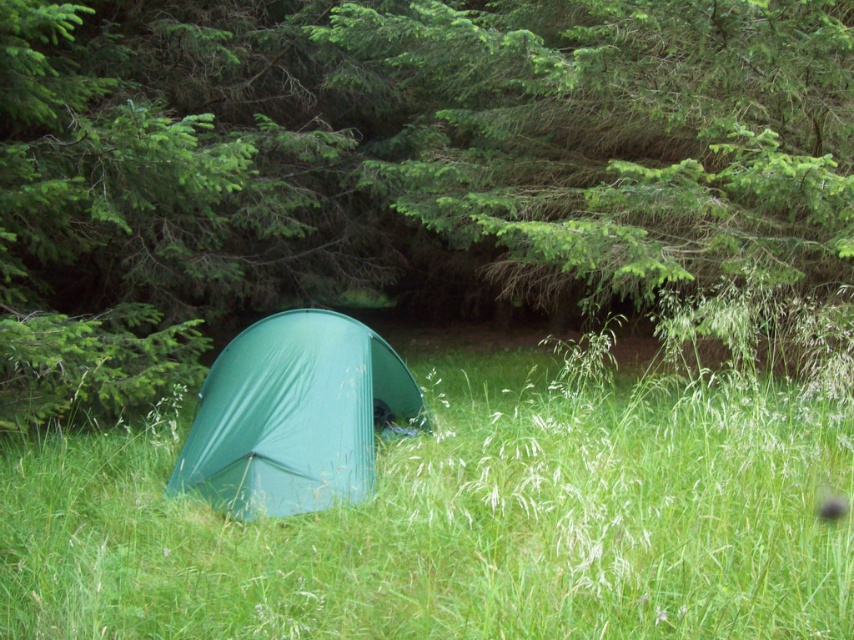
Can you confirm if green matte tent at center is taller than green tarpaulin tent at center?

Yes, green matte tent at center is taller than green tarpaulin tent at center.

Between point (300, 132) and point (273, 445), which one is positioned behind?

Point (300, 132)

Where is `green matte tent at center`? green matte tent at center is located at coordinates (396, 164).

Can you confirm if green fabric tent at center is thinner than green tarpaulin tent at center?

Yes, green fabric tent at center is thinner than green tarpaulin tent at center.

Can you confirm if green fabric tent at center is positioned to the right of green tarpaulin tent at center?

Yes, green fabric tent at center is to the right of green tarpaulin tent at center.

At what (x,y) coordinates should I click in order to perform the action: click on green fabric tent at center. Please return your answer as a coordinate pair (x, y). Image resolution: width=854 pixels, height=640 pixels. Looking at the image, I should click on (460, 524).

Is green matte tent at center positioned in front of green fabric tent at center?

No, it is not.

Can you confirm if green matte tent at center is wider than green fabric tent at center?

Indeed, green matte tent at center has a greater width compared to green fabric tent at center.

Who is more forward, [513,84] or [604,627]?

Positioned in front is point [604,627].

At what (x,y) coordinates should I click in order to perform the action: click on green matte tent at center. Please return your answer as a coordinate pair (x, y). This screenshot has width=854, height=640. Looking at the image, I should click on (396, 164).